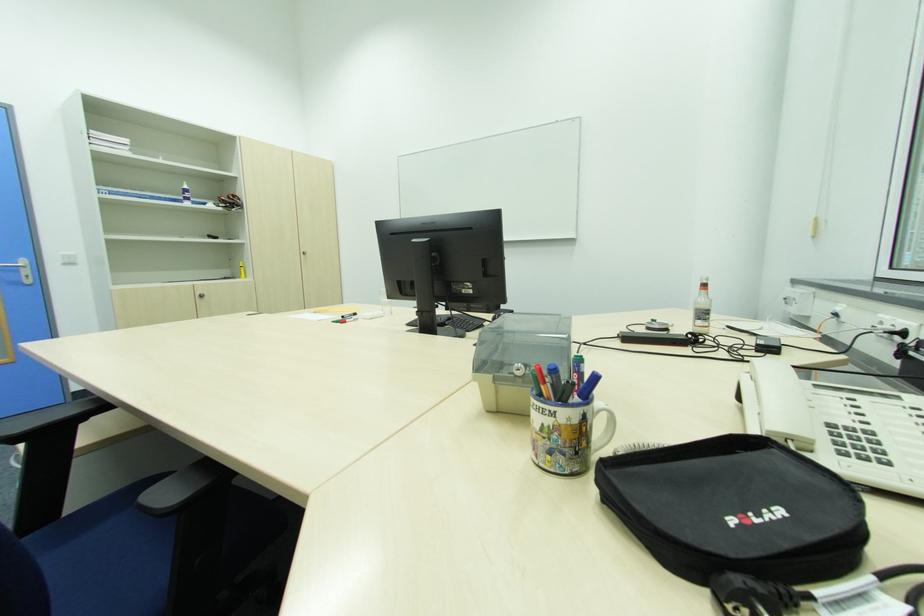
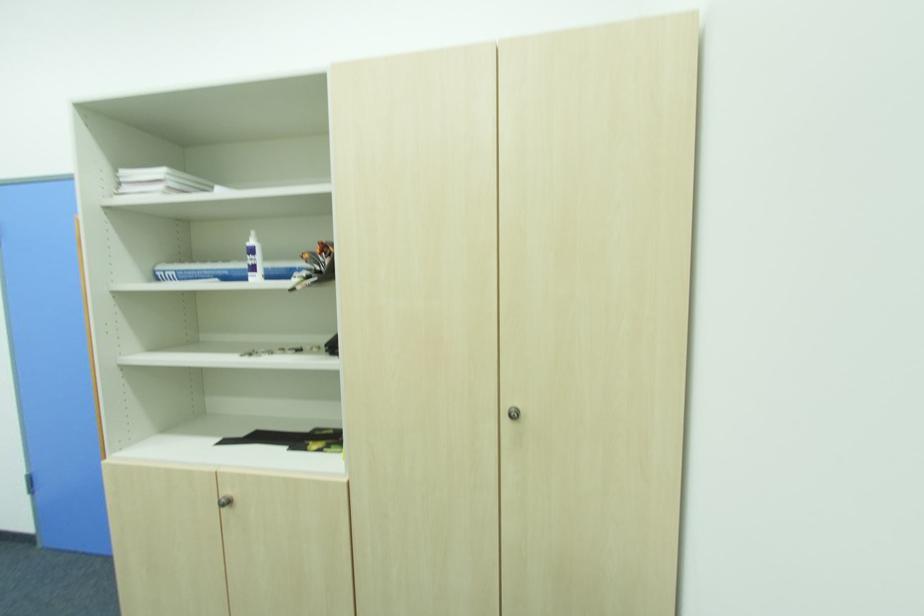
Locate, in the second image, the point that corresponds to (x=204, y=297) in the first image.

(229, 504)